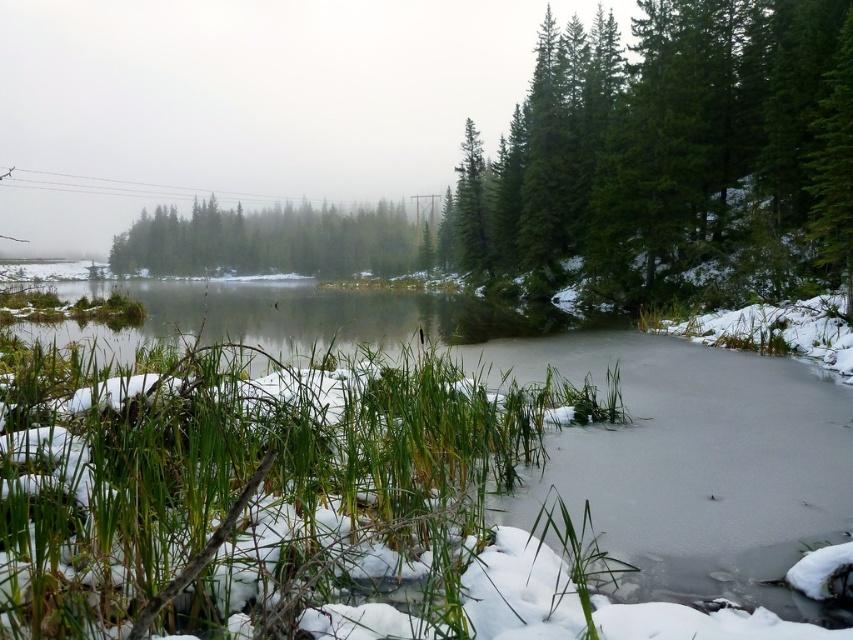
Based on the photo, you are standing in the winter landscape and want to take a photo of the green matte tree at upper right and the green matte trees at center. Which one should you focus on first to ensure both are in sharp focus?

You should focus on the green matte trees at center first because the green matte tree at upper right is closer to the viewer, so adjusting focus from the farther trees to the closer tree will help achieve sharpness for both.

You are an artist planning to paint the winter scene. You want to ensure the green matte tree at upper right and the green matte trees at center are proportionate. Which of these trees should be drawn taller in your painting?

The green matte tree at upper right should be drawn taller than the green matte trees at center because it is taller in the original scene.